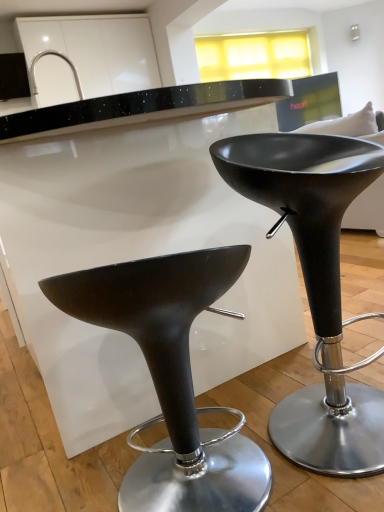
Question: Is matte black stool at lower left, marked as the 1th stool in a left-to-right arrangement, turned away from satin nickel faucet at upper left?

Choices:
 (A) yes
 (B) no

Answer: (B)

Question: Can you confirm if matte black stool at lower left, which ranks as the second stool in right-to-left order, is wider than satin nickel faucet at upper left?

Choices:
 (A) no
 (B) yes

Answer: (B)

Question: Considering the relative positions of matte black stool at lower left, which ranks as the second stool in right-to-left order, and satin nickel faucet at upper left in the image provided, is matte black stool at lower left, which ranks as the second stool in right-to-left order, to the left of satin nickel faucet at upper left from the viewer's perspective?

Choices:
 (A) no
 (B) yes

Answer: (A)

Question: From a real-world perspective, is matte black stool at lower left, marked as the 1th stool in a left-to-right arrangement, positioned over satin nickel faucet at upper left based on gravity?

Choices:
 (A) yes
 (B) no

Answer: (B)

Question: Is matte black stool at lower left, marked as the 1th stool in a left-to-right arrangement, aimed at satin nickel faucet at upper left?

Choices:
 (A) no
 (B) yes

Answer: (A)

Question: In terms of size, does matte black stool at lower left, which ranks as the second stool in right-to-left order, appear bigger or smaller than satin nickel faucet at upper left?

Choices:
 (A) small
 (B) big

Answer: (B)

Question: Is matte black stool at lower left, marked as the 1th stool in a left-to-right arrangement, to the left or to the right of satin nickel faucet at upper left in the image?

Choices:
 (A) right
 (B) left

Answer: (A)

Question: Is matte black stool at lower left, marked as the 1th stool in a left-to-right arrangement, wider or thinner than satin nickel faucet at upper left?

Choices:
 (A) thin
 (B) wide

Answer: (B)

Question: From a real-world perspective, relative to satin nickel faucet at upper left, is matte black stool at lower left, marked as the 1th stool in a left-to-right arrangement, vertically above or below?

Choices:
 (A) below
 (B) above

Answer: (A)

Question: Does point (31, 75) appear closer or farther from the camera than point (324, 253)?

Choices:
 (A) farther
 (B) closer

Answer: (A)

Question: From their relative heights in the image, would you say satin nickel faucet at upper left is taller or shorter than matte black stool at center, acting as the second stool starting from the left?

Choices:
 (A) short
 (B) tall

Answer: (A)

Question: Relative to matte black stool at center, acting as the second stool starting from the left, is satin nickel faucet at upper left in front or behind?

Choices:
 (A) front
 (B) behind

Answer: (B)

Question: Would you say satin nickel faucet at upper left is to the left or to the right of matte black stool at center, the 1th stool in the right-to-left sequence, in the picture?

Choices:
 (A) right
 (B) left

Answer: (B)

Question: Considering the positions of matte black stool at lower left, which ranks as the second stool in right-to-left order, and matte black stool at center, acting as the second stool starting from the left, in the image, is matte black stool at lower left, which ranks as the second stool in right-to-left order, bigger or smaller than matte black stool at center, acting as the second stool starting from the left,?

Choices:
 (A) small
 (B) big

Answer: (A)

Question: Is matte black stool at lower left, marked as the 1th stool in a left-to-right arrangement, to the left or to the right of matte black stool at center, acting as the second stool starting from the left, in the image?

Choices:
 (A) left
 (B) right

Answer: (A)